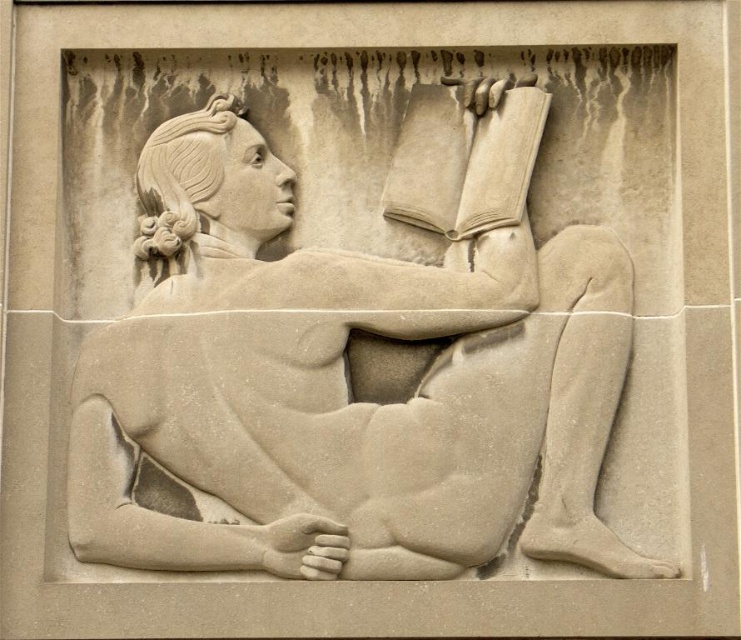
Which is more to the right, sandstone statue of reclining figure reading at center or smooth beige book at upper center?

smooth beige book at upper center

Can you confirm if sandstone statue of reclining figure reading at center is wider than smooth beige book at upper center?

Yes, sandstone statue of reclining figure reading at center is wider than smooth beige book at upper center.

Identify the location of sandstone statue of reclining figure reading at center. (353, 368).